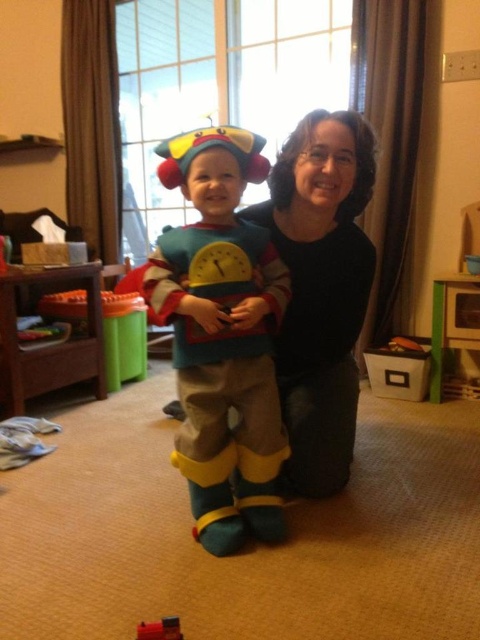
Question: Is black fabric at center further to the viewer compared to metallic red toy at lower left?

Choices:
 (A) no
 (B) yes

Answer: (B)

Question: Which object appears closest to the camera in this image?

Choices:
 (A) black fabric at center
 (B) fuzzy yellow costume at center

Answer: (B)

Question: Can you confirm if fuzzy yellow costume at center is positioned below metallic red toy at lower left?

Choices:
 (A) no
 (B) yes

Answer: (A)

Question: Estimate the real-world distances between objects in this image. Which object is closer to the black fabric at center?

Choices:
 (A) fuzzy yellow costume at center
 (B) metallic red toy at lower left

Answer: (A)

Question: Which of these objects is positioned closest to the fuzzy yellow costume at center?

Choices:
 (A) metallic red toy at lower left
 (B) black fabric at center

Answer: (B)

Question: Is fuzzy yellow costume at center to the right of metallic red toy at lower left from the viewer's perspective?

Choices:
 (A) yes
 (B) no

Answer: (A)